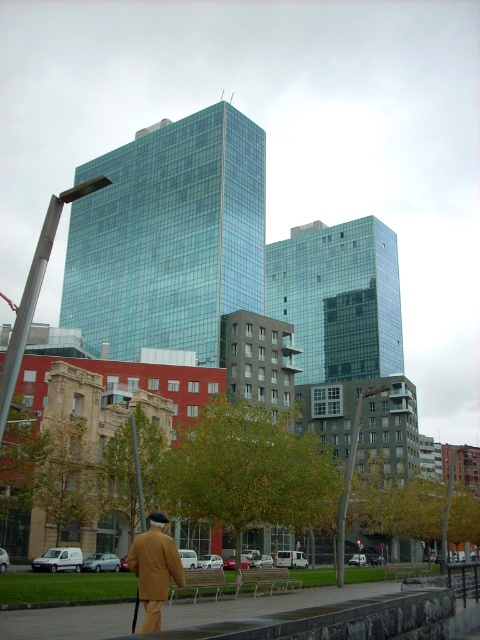
You are a tourist standing in the urban landscape and want to sit down on the gray concrete bench at lower center. However, there is a brown woolen coat at lower left nearby. Which object is closer to you, the tourist, so you can decide whether to move towards the bench or retrieve the coat first?

The gray concrete bench at lower center is closer to you than the brown woolen coat at lower left, so you should move towards the bench first.

In the scene shown: You are a city planner assessing public seating. You need to place a brown woolen coat at lower left on the gray concrete bench at lower center. Can the bench accommodate the coat without folding it?

The gray concrete bench at lower center has a larger width than the brown woolen coat at lower left, so it can accommodate the coat without folding it.

You are a city planner evaluating the urban space. You need to place a new sculpture that requires a base larger than the gray concrete bench at lower center. Is there enough space next to the brown woolen coat at lower left for the sculpture? Please explain your reasoning.

The gray concrete bench at lower center has a larger size compared to the brown woolen coat at lower left. Since the sculpture requires a base larger than the bench, the space next to the brown woolen coat at lower left is insufficient as it is smaller than the required size.